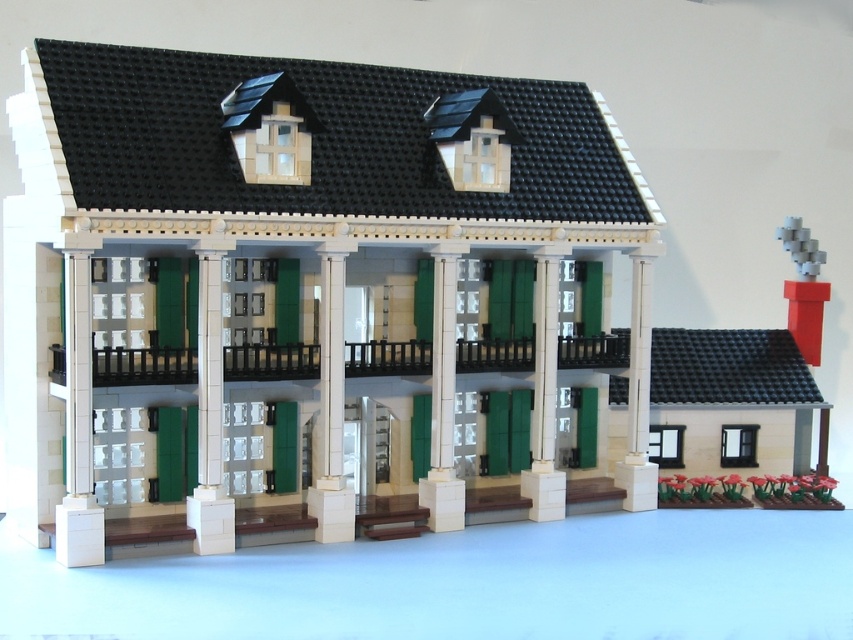
Question: Which of the following is the closest to the observer?

Choices:
 (A) (432, 316)
 (B) (206, 480)
 (C) (321, 340)

Answer: (B)

Question: From the image, what is the correct spatial relationship of beige/smooth pillar at center in relation to white smooth column at center?

Choices:
 (A) above
 (B) below

Answer: (A)

Question: Which point is closer to the camera?

Choices:
 (A) beige/smooth pillar at center
 (B) white glossy column at center
 (C) white smooth column at center

Answer: (A)

Question: Which is farther from the white glossy column at center?

Choices:
 (A) beige/smooth pillar at center
 (B) white smooth column at center

Answer: (A)

Question: Is beige/smooth pillar at center to the left of white glossy column at center from the viewer's perspective?

Choices:
 (A) no
 (B) yes

Answer: (B)

Question: Where is beige/smooth pillar at center located in relation to white smooth column at center in the image?

Choices:
 (A) above
 (B) below

Answer: (A)